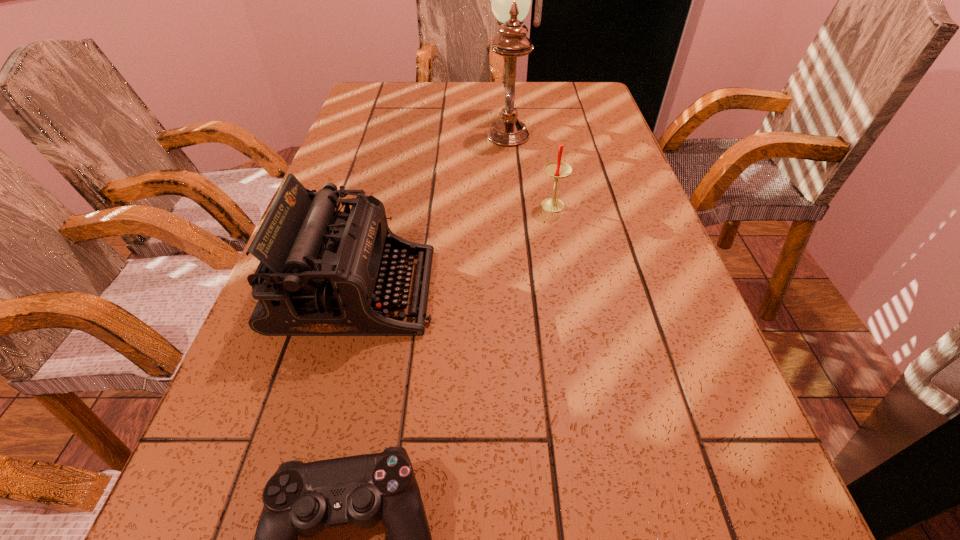
The image size is (960, 540). Identify the location of unoccupied position between the oil lamp and the third tallest object. (530, 166).

Identify the location of free space between the third shortest object and the candle. The width and height of the screenshot is (960, 540). (454, 249).

I want to click on vacant space that's between the typewriter and the farthest object, so click(431, 208).

Identify which object is the third closest to the candle. Please provide its 2D coordinates. Your answer should be formatted as a tuple, i.e. [(x, y)], where the tuple contains the x and y coordinates of a point satisfying the conditions above.

[(303, 499)]

Point out which object is positioned as the third nearest to the second farthest object. Please provide its 2D coordinates. Your answer should be formatted as a tuple, i.e. [(x, y)], where the tuple contains the x and y coordinates of a point satisfying the conditions above.

[(303, 499)]